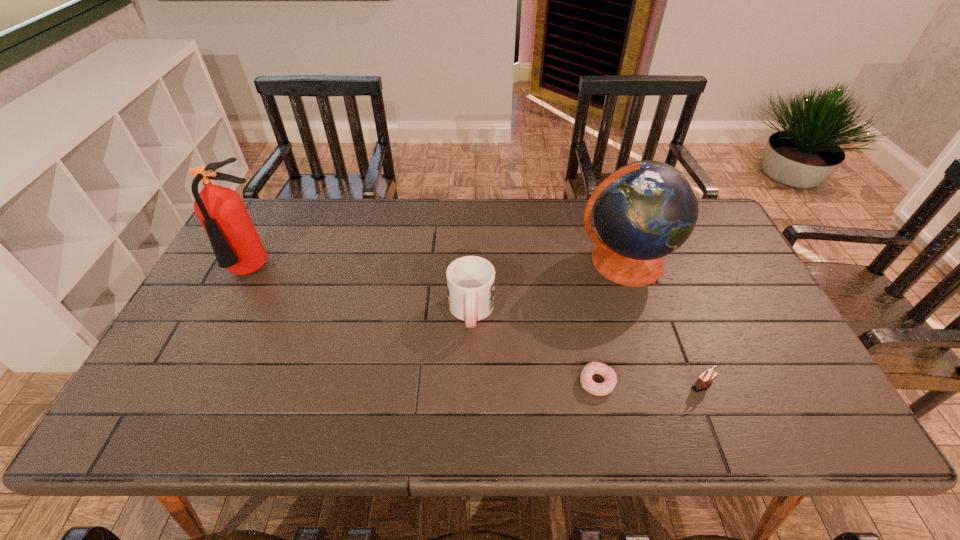
You are a GUI agent. You are given a task and a screenshot of the screen. Output one action in this format:
    pyautogui.click(x=<x>, y=<y>)
    Task: Click on the fire extinguisher
    
    Given the screenshot: What is the action you would take?
    pyautogui.click(x=237, y=247)

Locate an element on the screen. This screenshot has height=540, width=960. globe is located at coordinates (645, 210).

What are the coordinates of `the third shortest object` in the screenshot? It's located at (470, 279).

This screenshot has height=540, width=960. What are the coordinates of `the second object from left to right` in the screenshot? It's located at (470, 279).

Identify the location of the second shortest object. This screenshot has width=960, height=540. (704, 381).

This screenshot has height=540, width=960. I want to click on the shortest object, so click(x=610, y=378).

This screenshot has height=540, width=960. I want to click on vacant space located 0.230m at the nozzle of the fire extinguisher, so click(x=207, y=364).

Locate an element on the screen. This screenshot has height=540, width=960. vacant position located 0.070m with the Americas facing the viewer on the globe is located at coordinates (640, 313).

Identify the location of free space located 0.110m on the side of the fourth object from right to left with the handle. (470, 375).

Find the location of a particular element. The image size is (960, 540). vacant space located 0.210m on the back of the fourth tallest object is located at coordinates (672, 311).